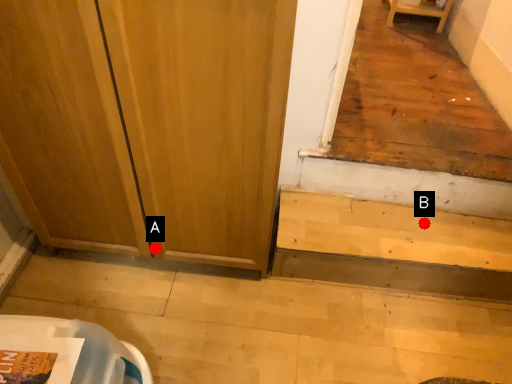
Question: Two points are circled on the image, labeled by A and B beside each circle. Which point is closer to the camera taking this photo?

Choices:
 (A) A is closer
 (B) B is closer

Answer: (A)